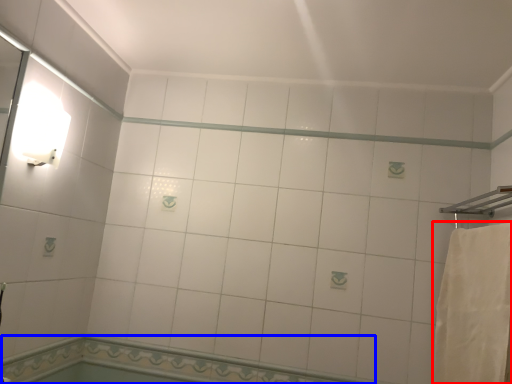
Question: Which object appears farthest to the camera in this image, bath towel (highlighted by a red box) or bath (highlighted by a blue box)?

Choices:
 (A) bath towel
 (B) bath

Answer: (B)